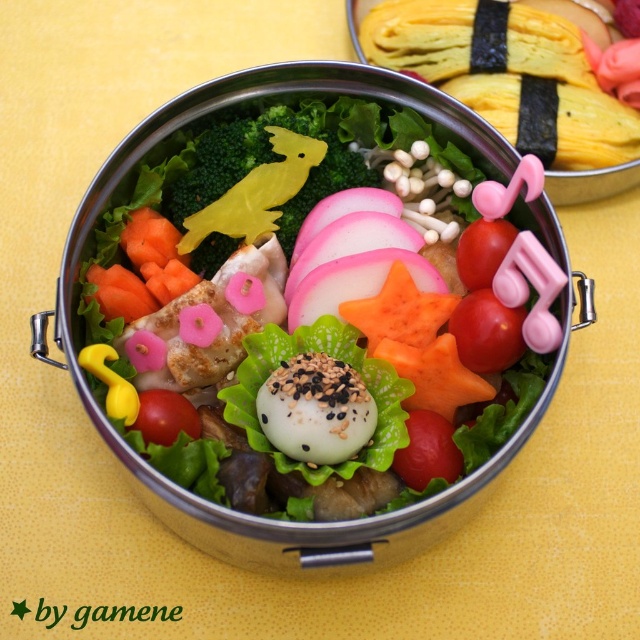
Question: Which object is the farthest from the white glossy rice ball at center?

Choices:
 (A) pink translucent onion at center
 (B) green matte broccoli at center

Answer: (A)

Question: Is green matte broccoli at center positioned before pink translucent onion at center?

Choices:
 (A) yes
 (B) no

Answer: (B)

Question: Can you confirm if green matte broccoli at center is positioned above pink translucent onion at center?

Choices:
 (A) no
 (B) yes

Answer: (B)

Question: Which point is closer to the camera taking this photo?

Choices:
 (A) (323, 284)
 (B) (294, 486)

Answer: (B)

Question: Is green matte broccoli at center wider than pink translucent onion at center?

Choices:
 (A) no
 (B) yes

Answer: (B)

Question: Considering the real-world distances, which object is closest to the white glossy rice ball at center?

Choices:
 (A) pink translucent onion at center
 (B) green matte broccoli at center

Answer: (B)